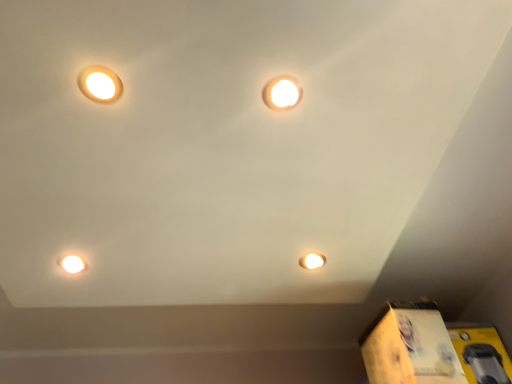
Question: From a real-world perspective, relative to matte white light bulb at lower left, is yellow cardboard box at lower right, marked as the 1th cardboard box in a left-to-right arrangement, vertically above or below?

Choices:
 (A) above
 (B) below

Answer: (B)

Question: From the image's perspective, is yellow cardboard box at lower right, marked as the 1th cardboard box in a left-to-right arrangement, positioned above or below matte white light bulb at lower left?

Choices:
 (A) below
 (B) above

Answer: (A)

Question: Which is farther from the matte white lamp at upper left, marked as the 2th lamp in a right-to-left arrangement?

Choices:
 (A) matte white light bulb at lower left
 (B) yellow cardboard box at lower right, which ranks as the first cardboard box in right-to-left order
 (C) yellow cardboard box at lower right, which ranks as the second cardboard box in right-to-left order
 (D) matte white light at upper center, which is the second lamp from left to right

Answer: (B)

Question: Based on their relative distances, which object is farther from the yellow cardboard box at lower right, which ranks as the first cardboard box in right-to-left order?

Choices:
 (A) matte white light at upper center, which is the second lamp from left to right
 (B) matte white lamp at upper left, marked as the 2th lamp in a right-to-left arrangement
 (C) matte white light bulb at lower left
 (D) yellow cardboard box at lower right, which ranks as the second cardboard box in right-to-left order

Answer: (B)